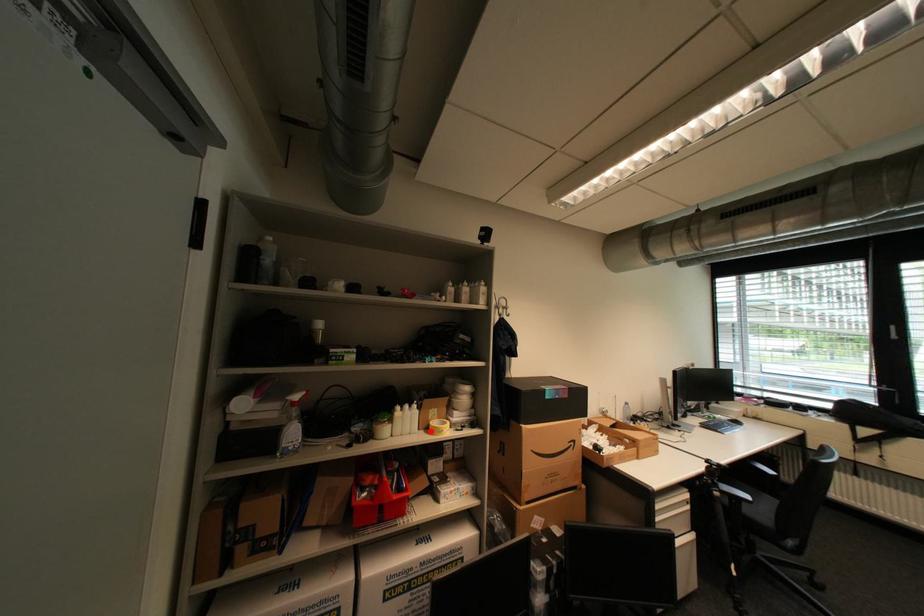
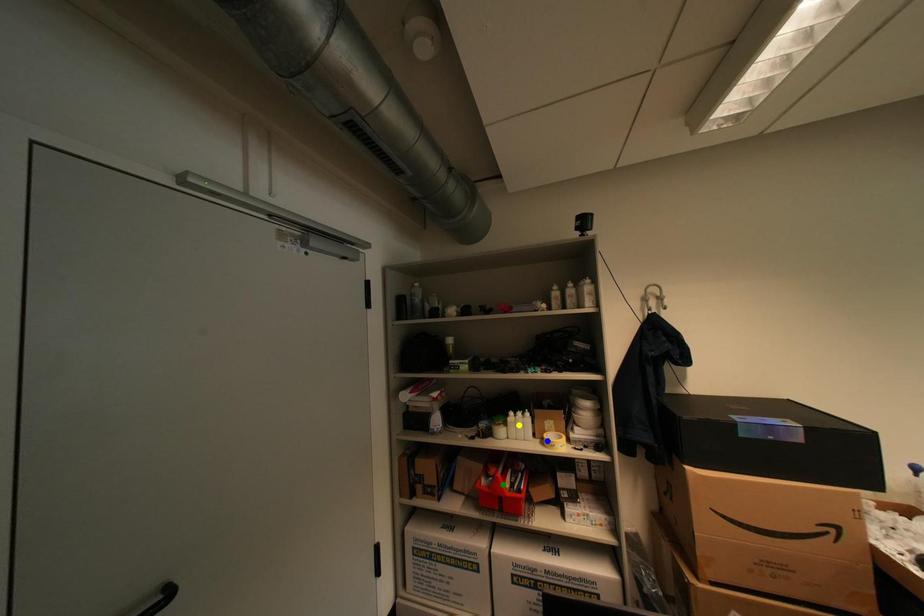
Question: I am providing you with two images of the same scene from different viewpoints. A red point is marked on the first image. You are given multiple points on the second image. Which point in image 2 is actually the same real-world point as the red point in image 1?

Choices:
 (A) blue point
 (B) yellow point
 (C) green point

Answer: (A)